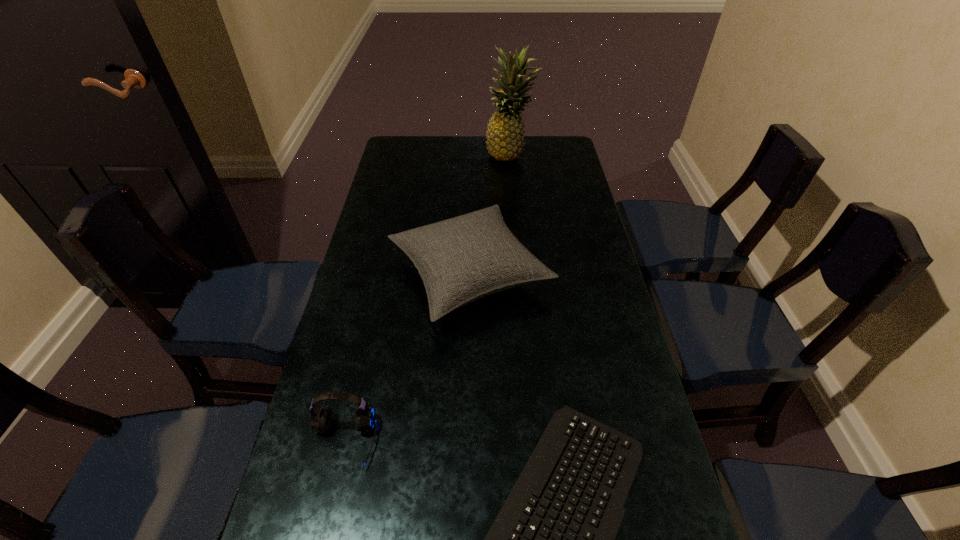
Image resolution: width=960 pixels, height=540 pixels. I want to click on headset present at the left edge, so click(321, 416).

The height and width of the screenshot is (540, 960). I want to click on pineapple located at the right edge, so click(x=505, y=137).

At what (x,y) coordinates should I click in order to perform the action: click on cushion positioned at the right edge. Please return your answer as a coordinate pair (x, y). This screenshot has width=960, height=540. Looking at the image, I should click on (460, 260).

Where is `object located in the far right corner section of the desktop`? This screenshot has height=540, width=960. object located in the far right corner section of the desktop is located at coordinates (505, 137).

The width and height of the screenshot is (960, 540). I want to click on free spot at the far edge of the desktop, so click(447, 143).

This screenshot has width=960, height=540. I want to click on vacant area at the left edge, so click(x=370, y=212).

Where is `free space at the right edge of the desktop`? This screenshot has width=960, height=540. free space at the right edge of the desktop is located at coordinates (538, 189).

I want to click on vacant space at the far left corner, so click(426, 165).

I want to click on vacant space at the far right corner, so click(556, 148).

Locate an element on the screen. free space between the third shortest object and the second shortest object is located at coordinates (407, 358).